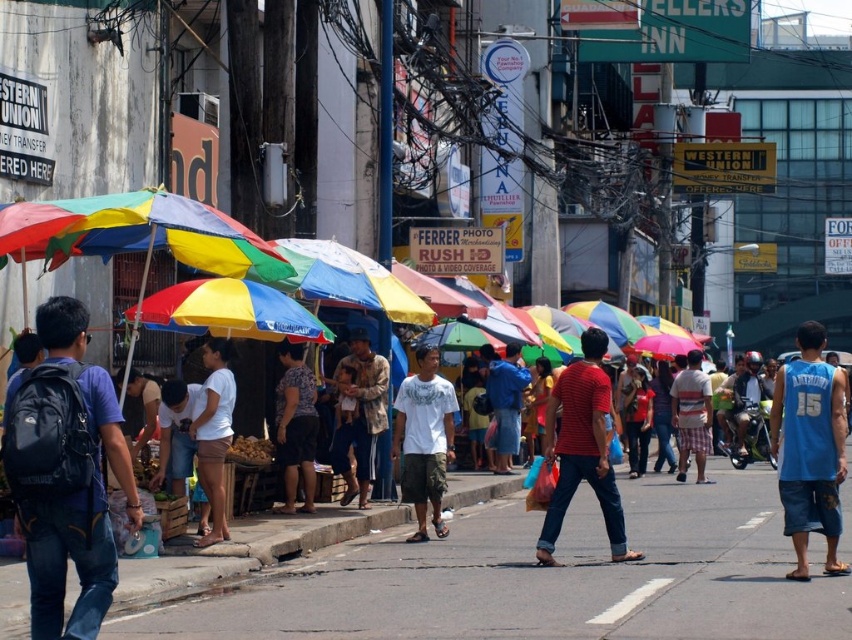
Can you confirm if blue denim pants at center is wider than striped t-shirt at center?

Correct, the width of blue denim pants at center exceeds that of striped t-shirt at center.

Between blue denim pants at center and striped t-shirt at center, which one is positioned higher?

blue denim pants at center

What are the coordinates of `blue denim pants at center` in the screenshot? It's located at (361, 413).

Which is in front, point (429, 492) or point (701, 440)?

Point (429, 492) is in front.

Find the location of `white cotton shirt at center`. white cotton shirt at center is located at coordinates (424, 440).

Is matte black backpack at left smaller than red striped shirt at center?

Incorrect, matte black backpack at left is not smaller in size than red striped shirt at center.

Does matte black backpack at left appear over red striped shirt at center?

Yes, matte black backpack at left is above red striped shirt at center.

Is point (125, 508) in front of point (622, 529)?

That is False.

Identify the location of matte black backpack at left. (79, 525).